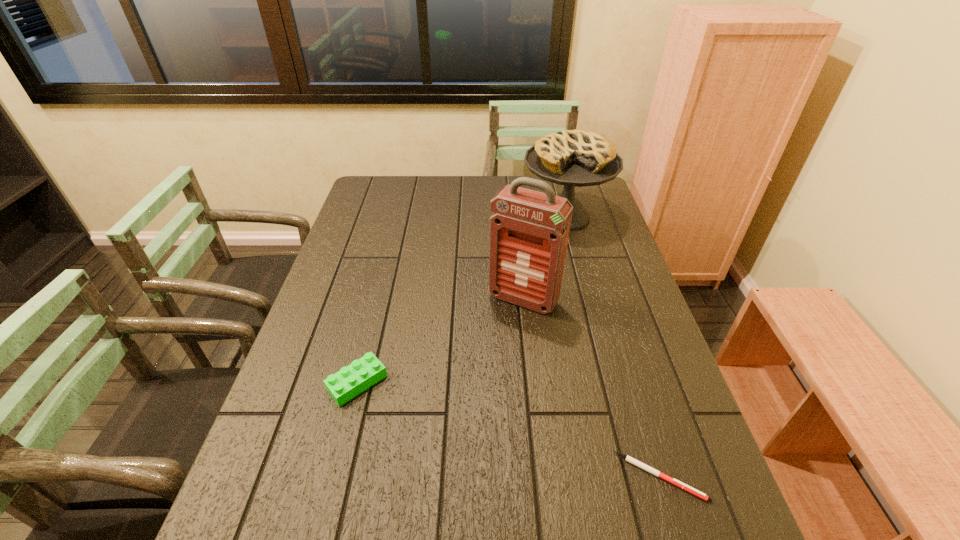
The image size is (960, 540). Identify the location of vacant point located between the leftmost object and the pie. point(461,300).

Identify the location of vacant area between the second tallest object and the pen. The image size is (960, 540). (612, 347).

Locate an element on the screen. The height and width of the screenshot is (540, 960). vacant space in between the tallest object and the nearest object is located at coordinates (591, 388).

Find the location of a particular element. The height and width of the screenshot is (540, 960). free spot between the shortest object and the farthest object is located at coordinates (612, 347).

What are the coordinates of `vacant point located between the third tallest object and the farthest object` in the screenshot? It's located at (461, 300).

Locate an element on the screen. empty location between the leftmost object and the third nearest object is located at coordinates (441, 341).

The image size is (960, 540). Identify the location of unoccupied area between the shortest object and the tallest object. (591, 388).

The height and width of the screenshot is (540, 960). What are the coordinates of `the second closest object relative to the pie` in the screenshot? It's located at (350, 381).

Identify which object is located as the second nearest to the second farthest object. Please provide its 2D coordinates. Your answer should be formatted as a tuple, i.e. [(x, y)], where the tuple contains the x and y coordinates of a point satisfying the conditions above.

[(350, 381)]

Find the location of a particular element. vacant space that satisfies the following two spatial constraints: 1. on the front side of the nearest object; 2. on the clicker of the third shortest object is located at coordinates (633, 477).